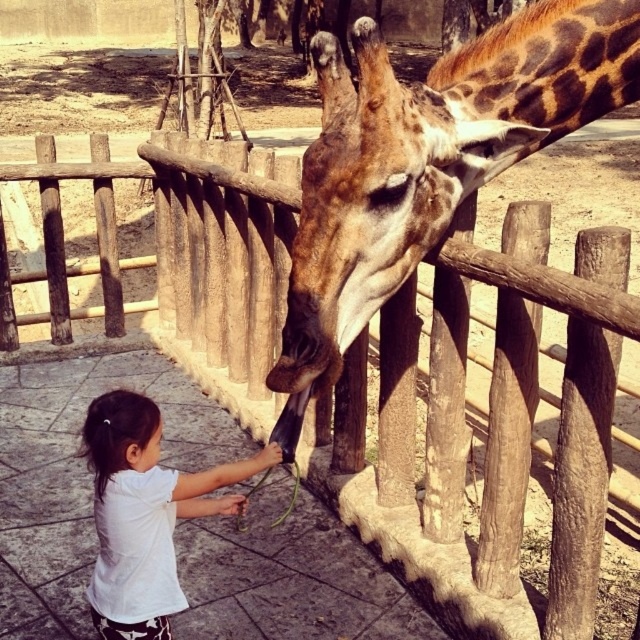
Question: Which point appears farthest from the camera in this image?

Choices:
 (A) (112, 548)
 (B) (292, 285)

Answer: (A)

Question: Is spotted brown giraffe at center wider than white cotton shirt at lower left?

Choices:
 (A) yes
 (B) no

Answer: (A)

Question: Among these objects, which one is farthest from the camera?

Choices:
 (A) spotted brown giraffe at center
 (B) white cotton shirt at lower left

Answer: (B)

Question: Is spotted brown giraffe at center bigger than white cotton shirt at lower left?

Choices:
 (A) yes
 (B) no

Answer: (A)

Question: Is spotted brown giraffe at center in front of white cotton shirt at lower left?

Choices:
 (A) no
 (B) yes

Answer: (B)